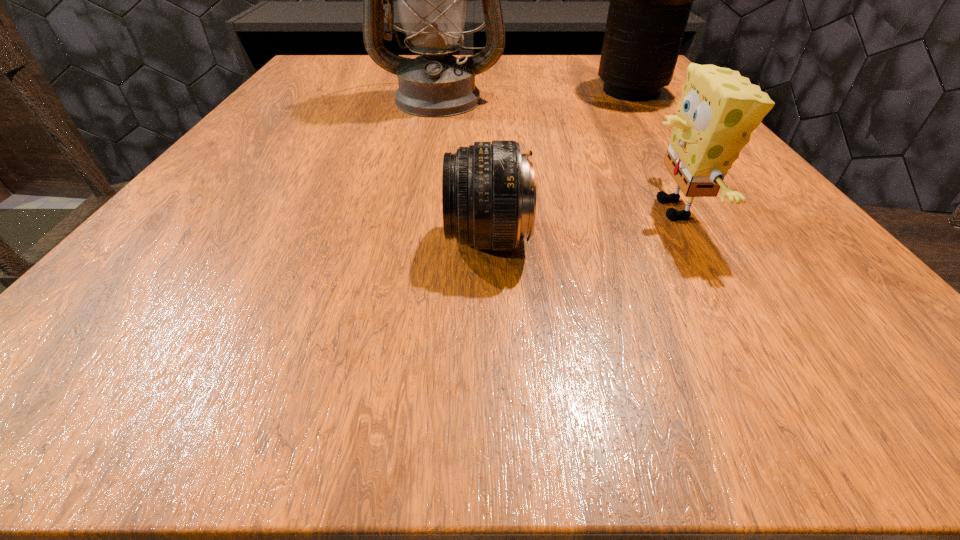
Find the location of a particular element. This screenshot has height=540, width=960. oil lamp is located at coordinates (432, 0).

I want to click on the farther telephoto lens, so click(x=650, y=0).

Image resolution: width=960 pixels, height=540 pixels. Identify the location of the second tallest object. (650, 0).

Where is `sponge`? The height and width of the screenshot is (540, 960). sponge is located at coordinates (719, 109).

You are a GUI agent. You are given a task and a screenshot of the screen. Output one action in this format:
    pyautogui.click(x=<x>, y=<y>)
    Task: Click on the nearer telephoto lens
    This screenshot has width=960, height=540.
    Given the screenshot: What is the action you would take?
    pyautogui.click(x=488, y=189)

Image resolution: width=960 pixels, height=540 pixels. In order to click on the left telephoto lens in this screenshot , I will do `click(488, 189)`.

At what (x,y) coordinates should I click in order to perform the action: click on vacant space located on the left of the oil lamp. Please return your answer as a coordinate pair (x, y). Image resolution: width=960 pixels, height=540 pixels. Looking at the image, I should click on (306, 99).

Locate an element on the screen. The height and width of the screenshot is (540, 960). vacant space located 0.200m on the front of the right telephoto lens is located at coordinates (675, 153).

Find the location of `vacant space located 0.100m on the face of the sponge`. vacant space located 0.100m on the face of the sponge is located at coordinates coord(572,210).

At what (x,y) coordinates should I click in order to perform the action: click on vacant space situated on the face of the sponge. Please return your answer as a coordinate pair (x, y). Looking at the image, I should click on (499, 210).